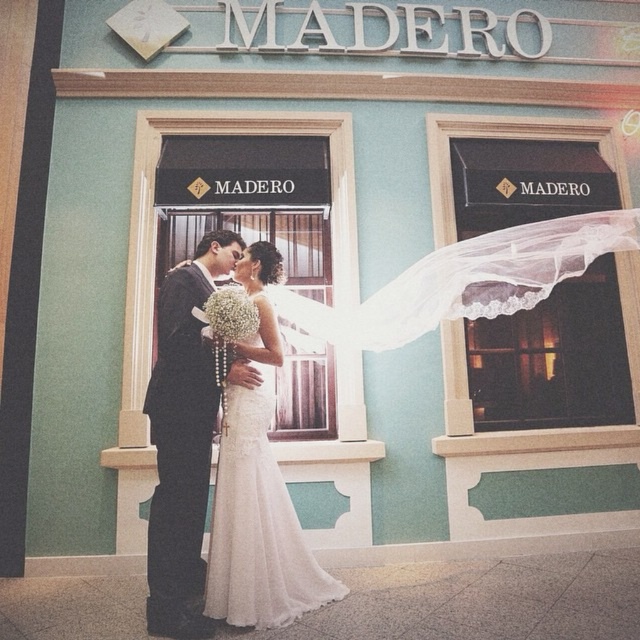
You are a photographer at the wedding. You need to position a spotlight to the right of both the matte black suit at center and the white lace wedding dress at center. Is this possible given their current positions?

The matte black suit at center is to the left of white lace wedding dress at center, so the spotlight can be placed to the right of both objects since they are aligned horizontally.

You are a photographer standing at the back of the venue. You want to take a closeup shot of the matte black suit at center. Given that your camera has a maximum focus range of 3 meters, will you be able to capture a clear image?

The matte black suit at center is 3.37 meters away from the camera. Since the maximum focus range is 3 meters, the photographer will not be able to capture a clear image as the distance exceeds the camera capabilities.

In the scene shown: You are a photographer standing 3 meters away from the couple. You want to take a closeup photo of the matte black suit at center and white lace wedding dress at center without any blur. Given that your camera can focus clearly on objects within a 25 cm range, will you be able to capture both clearly in focus?

The matte black suit at center is 26.73 centimeters away from the white lace wedding dress at center. Since the camera can only focus clearly within a 25 cm range, the distance between them exceeds the camera focus range. Therefore, you cannot capture both clearly in focus without adjusting your position or equipment.